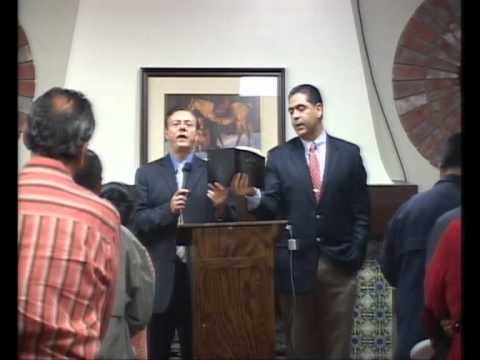
Identify the location of wall. (283, 33).